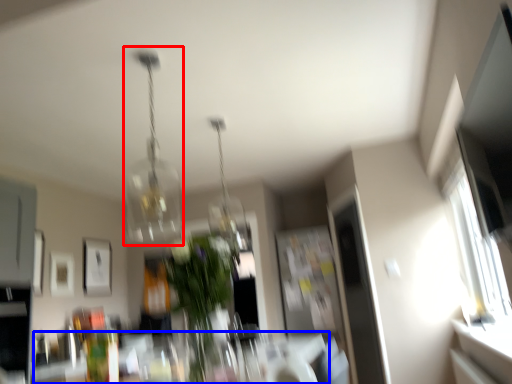
Question: Which object appears farthest to the camera in this image, lamp (highlighted by a red box) or table (highlighted by a blue box)?

Choices:
 (A) lamp
 (B) table

Answer: (A)